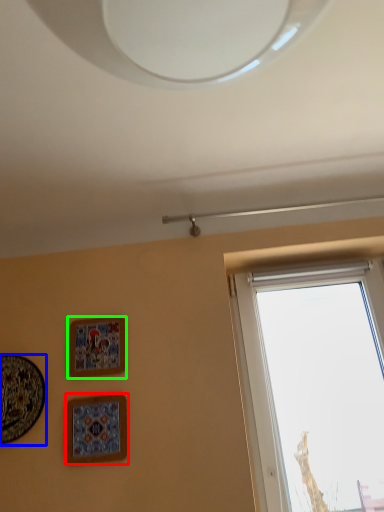
Question: Which is nearer to the picture frame (highlighted by a red box)? picture frame (highlighted by a blue box) or picture frame (highlighted by a green box).

Choices:
 (A) picture frame
 (B) picture frame

Answer: (B)